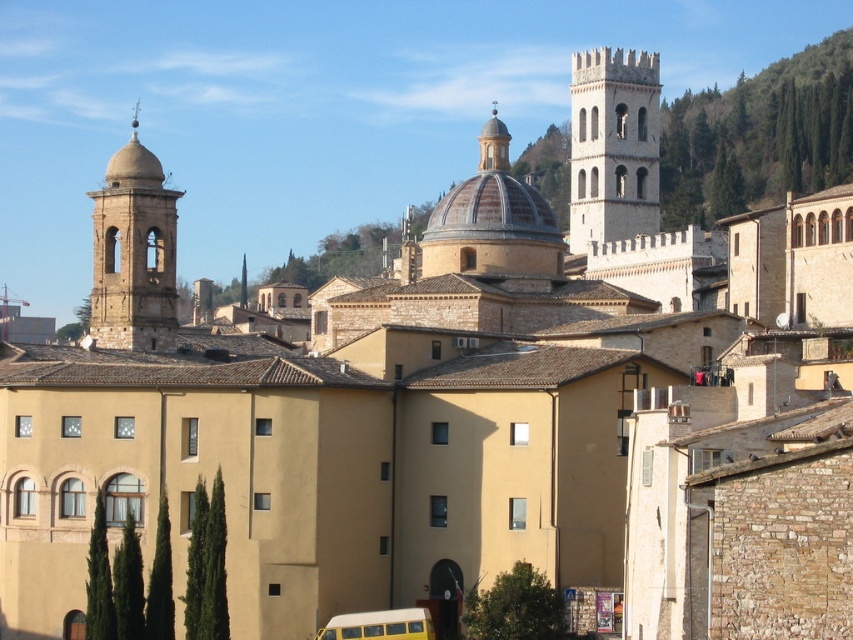
Is smooth stone bell tower at left further to camera compared to yellow matte school bus at lower center?

Yes, it is.

Measure the distance between smooth stone bell tower at left and yellow matte school bus at lower center.

A distance of 72.69 meters exists between smooth stone bell tower at left and yellow matte school bus at lower center.

Which is behind, point (154, 308) or point (401, 637)?

Point (154, 308)

Identify the location of smooth stone bell tower at left. This screenshot has height=640, width=853. (132, 252).

Does stone tower at upper right appear on the right side of yellow matte school bus at lower center?

Yes, stone tower at upper right is to the right of yellow matte school bus at lower center.

Is point (584, 58) farther from camera compared to point (401, 628)?

Yes, point (584, 58) is behind point (401, 628).

The height and width of the screenshot is (640, 853). Identify the location of stone tower at upper right. point(613,147).

Is stone tower at upper right above smooth stone bell tower at left?

No, stone tower at upper right is not above smooth stone bell tower at left.

Is stone tower at upper right taller than smooth stone bell tower at left?

No.

Which is behind, point (653, 225) or point (100, 316)?

The point (653, 225) is more distant.

The width and height of the screenshot is (853, 640). Find the location of `stone tower at upper right`. stone tower at upper right is located at coordinates (613, 147).